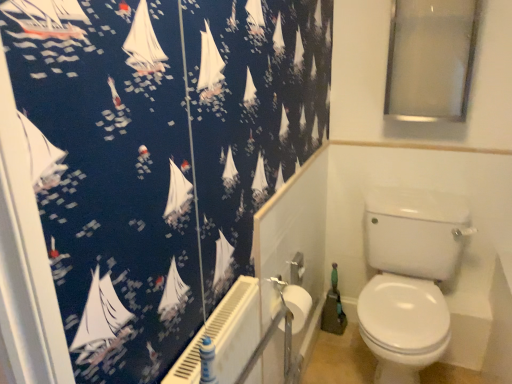
Measure the distance between white plastic radiator at lower center and camera.

white plastic radiator at lower center is 32.44 inches away from camera.

In order to face transparent glass window screen at upper right, should I rotate leftwards or rightwards?

You should rotate right by 21.549 degrees.

Locate an element on the screen. This screenshot has width=512, height=384. white glossy bidet at lower right is located at coordinates (403, 326).

Is white glossy toilet at lower right completely or partially outside of white matte toilet paper at lower center?

white glossy toilet at lower right lies outside white matte toilet paper at lower center's area.

Which is more to the left, white glossy toilet at lower right or white matte toilet paper at lower center?

Positioned to the left is white matte toilet paper at lower center.

Is white glossy toilet at lower right looking in the opposite direction of white matte toilet paper at lower center?

That's not correct — white glossy toilet at lower right is not looking away from white matte toilet paper at lower center.

Locate an element on the screen. toilet paper behind the white glossy toilet at lower right is located at coordinates (297, 305).

Is white matte toilet paper at lower center facing away from white glossy bidet at lower right?

white matte toilet paper at lower center is not turned away from white glossy bidet at lower right.

Is white glossy bidet at lower right a part of white matte toilet paper at lower center?

No, white glossy bidet at lower right is not inside white matte toilet paper at lower center.

Where is `toilet paper located in front of the white glossy bidet at lower right`? toilet paper located in front of the white glossy bidet at lower right is located at coordinates (297, 305).

From a real-world perspective, is white matte toilet paper at lower center located higher than white glossy bidet at lower right?

Yes.

In the scene shown: Which object is positioned more to the right, white matte toilet paper at lower center or white plastic radiator at lower center?

white matte toilet paper at lower center.

In the scene shown: Is white matte toilet paper at lower center further to camera compared to white plastic radiator at lower center?

Yes, white matte toilet paper at lower center is behind white plastic radiator at lower center.

Could you tell me if white matte toilet paper at lower center is turned towards white plastic radiator at lower center?

No, white matte toilet paper at lower center is not oriented towards white plastic radiator at lower center.

Considering the positions of point (420, 287) and point (431, 209), is point (420, 287) closer or farther from the camera than point (431, 209)?

Clearly, point (420, 287) is closer to the camera than point (431, 209).

Could you tell me if white glossy bidet at lower right is facing white glossy toilet at lower right?

Yes, white glossy bidet at lower right is oriented towards white glossy toilet at lower right.

In the scene shown: From the image's perspective, which object appears higher, white glossy bidet at lower right or white glossy toilet at lower right?

white glossy toilet at lower right appears higher in the image.

Can you confirm if white glossy bidet at lower right is wider than white glossy toilet at lower right?

No, white glossy bidet at lower right is not wider than white glossy toilet at lower right.

Who is shorter, white plastic radiator at lower center or transparent glass window screen at upper right?

Standing shorter between the two is white plastic radiator at lower center.

Where is `radiator in front of the transparent glass window screen at upper right`? The width and height of the screenshot is (512, 384). radiator in front of the transparent glass window screen at upper right is located at coordinates (224, 336).

Considering the sizes of white plastic radiator at lower center and transparent glass window screen at upper right in the image, is white plastic radiator at lower center bigger or smaller than transparent glass window screen at upper right?

white plastic radiator at lower center is smaller than transparent glass window screen at upper right.

Is white plastic radiator at lower center to the right of transparent glass window screen at upper right from the viewer's perspective?

No, white plastic radiator at lower center is not to the right of transparent glass window screen at upper right.

From a real-world perspective, which is physically above, white glossy toilet at lower right or transparent glass window screen at upper right?

transparent glass window screen at upper right is physically above.

At what (x,y) coordinates should I click in order to perform the action: click on toilet bowl below the transparent glass window screen at upper right (from a real-world perspective). Please return your answer as a coordinate pair (x, y). Looking at the image, I should click on (409, 278).

Consider the image. Considering the relative sizes of white glossy toilet at lower right and transparent glass window screen at upper right in the image provided, is white glossy toilet at lower right smaller than transparent glass window screen at upper right?

No, white glossy toilet at lower right is not smaller than transparent glass window screen at upper right.

Locate an element on the screen. The image size is (512, 384). toilet paper above the white glossy toilet at lower right (from the image's perspective) is located at coordinates (297, 305).

Considering the sizes of objects white matte toilet paper at lower center and white glossy toilet at lower right in the image provided, who is shorter, white matte toilet paper at lower center or white glossy toilet at lower right?

With less height is white matte toilet paper at lower center.

From the image's perspective, between white matte toilet paper at lower center and white glossy toilet at lower right, who is located below?

white glossy toilet at lower right, from the image's perspective.

I want to click on toilet bowl to the right of white matte toilet paper at lower center, so click(409, 278).

Identify the location of bidet below the white matte toilet paper at lower center (from a real-world perspective). The image size is (512, 384). (403, 326).

Consider the image. From the image, which object appears to be farther from white glossy toilet at lower right, white plastic radiator at lower center or white glossy bidet at lower right?

white plastic radiator at lower center is further to white glossy toilet at lower right.

Looking at the image, which one is located closer to white plastic radiator at lower center, white glossy bidet at lower right or transparent glass window screen at upper right?

Among the two, white glossy bidet at lower right is located nearer to white plastic radiator at lower center.

When comparing their distances from transparent glass window screen at upper right, does white plastic radiator at lower center or white glossy toilet at lower right seem further?

Based on the image, white plastic radiator at lower center appears to be further to transparent glass window screen at upper right.

In the scene shown: Considering their positions, is white glossy toilet at lower right positioned further to white matte toilet paper at lower center than transparent glass window screen at upper right?

transparent glass window screen at upper right lies further to white matte toilet paper at lower center than the other object.

Looking at the image, which one is located closer to white glossy toilet at lower right, transparent glass window screen at upper right or white matte toilet paper at lower center?

white matte toilet paper at lower center is closer to white glossy toilet at lower right.

When comparing their distances from white matte toilet paper at lower center, does white plastic radiator at lower center or transparent glass window screen at upper right seem closer?

Based on the image, white plastic radiator at lower center appears to be nearer to white matte toilet paper at lower center.

From the image, which object appears to be farther from white matte toilet paper at lower center, white glossy bidet at lower right or white glossy toilet at lower right?

white glossy toilet at lower right lies further to white matte toilet paper at lower center than the other object.

Considering their positions, is white plastic radiator at lower center positioned closer to white glossy bidet at lower right than white matte toilet paper at lower center?

white matte toilet paper at lower center is closer to white glossy bidet at lower right.

At what (x,y) coordinates should I click in order to perform the action: click on radiator between transparent glass window screen at upper right and white glossy toilet at lower right from top to bottom. Please return your answer as a coordinate pair (x, y). The width and height of the screenshot is (512, 384). Looking at the image, I should click on (224, 336).

Image resolution: width=512 pixels, height=384 pixels. In order to click on toilet paper between transparent glass window screen at upper right and white glossy bidet at lower right from top to bottom in this screenshot , I will do `click(297, 305)`.

Locate an element on the screen. The width and height of the screenshot is (512, 384). toilet bowl between white matte toilet paper at lower center and white glossy bidet at lower right in the horizontal direction is located at coordinates (409, 278).

At what (x,y) coordinates should I click in order to perform the action: click on toilet bowl between white plastic radiator at lower center and white glossy bidet at lower right along the z-axis. Please return your answer as a coordinate pair (x, y). Looking at the image, I should click on (409, 278).